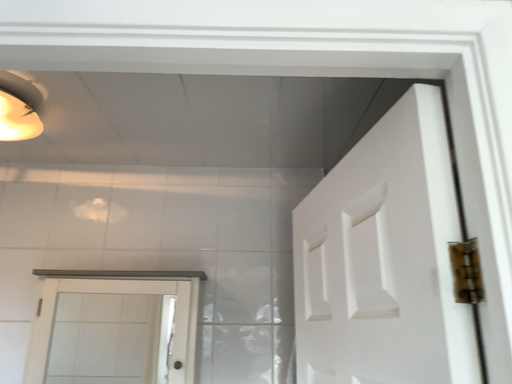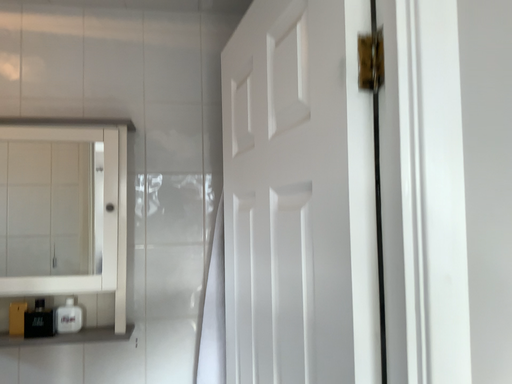
Question: Which way did the camera rotate in the video?

Choices:
 (A) rotated downward
 (B) rotated upward

Answer: (A)